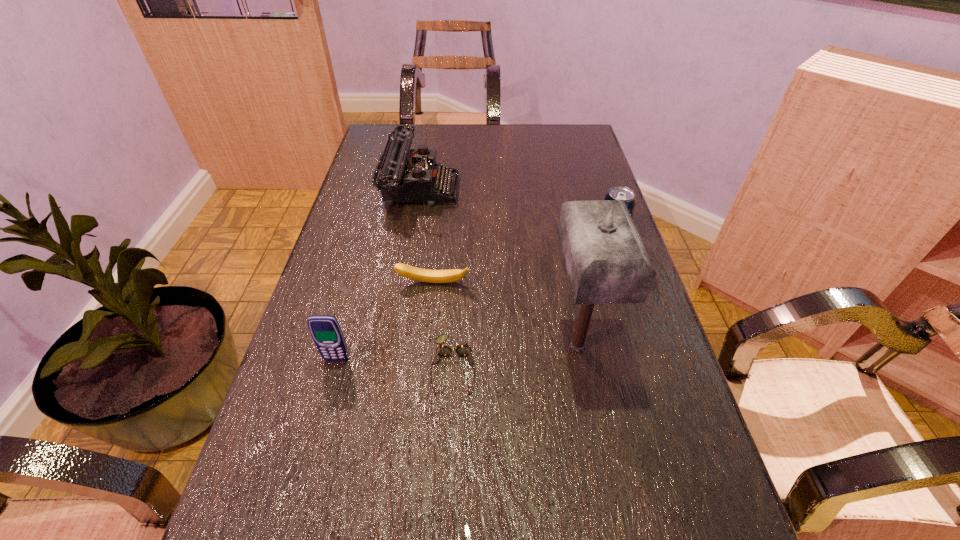
This screenshot has width=960, height=540. In order to click on free space at the left edge of the desktop in this screenshot , I will do `click(302, 330)`.

Find the location of `vacant space at the right edge of the desktop`. vacant space at the right edge of the desktop is located at coordinates (645, 441).

You are a GUI agent. You are given a task and a screenshot of the screen. Output one action in this format:
    pyautogui.click(x=<x>, y=<y>)
    Task: Click on the free space at the far left corner of the desktop
    
    Given the screenshot: What is the action you would take?
    pyautogui.click(x=416, y=140)

Identify the location of free space at the far right corner. This screenshot has width=960, height=540. (585, 127).

Locate an element on the screen. Image resolution: width=960 pixels, height=540 pixels. vacant space in between the shortest object and the cellular telephone is located at coordinates (395, 363).

At what (x,y) coordinates should I click in order to perform the action: click on free space between the cellular telephone and the farthest object. Please return your answer as a coordinate pair (x, y). Image resolution: width=960 pixels, height=540 pixels. Looking at the image, I should click on (378, 274).

Locate an element on the screen. This screenshot has height=540, width=960. vacant area that lies between the typewriter and the cellular telephone is located at coordinates (378, 274).

This screenshot has height=540, width=960. Identify the location of empty space between the rightmost object and the typewriter. (516, 212).

Identify the location of free space that is in between the cellular telephone and the shortest object. (395, 363).

Find the location of `vacant point located between the rightmost object and the second shortest object`. vacant point located between the rightmost object and the second shortest object is located at coordinates (522, 260).